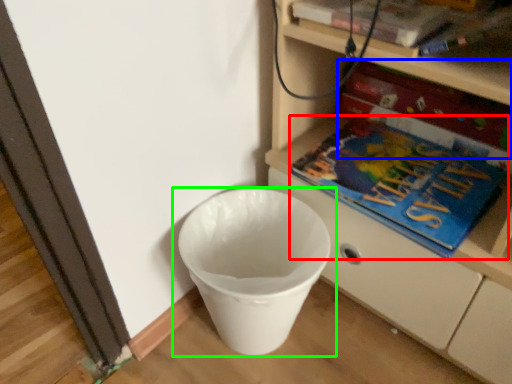
Question: Considering the real-world distances, which object is farthest from book (highlighted by a red box)? paperback book (highlighted by a blue box) or waste container (highlighted by a green box)?

Choices:
 (A) paperback book
 (B) waste container

Answer: (B)